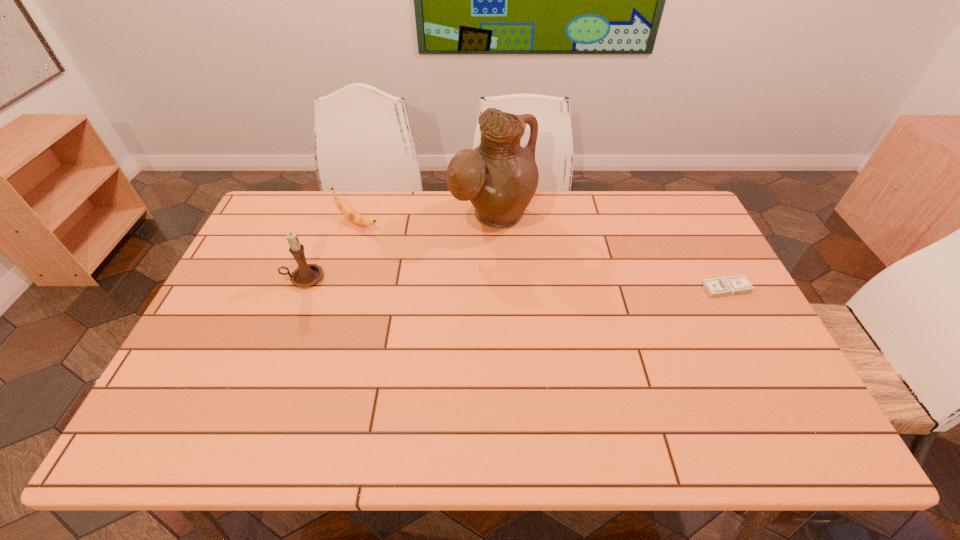
Locate an element on the screen. free spot on the desktop that is between the second tallest object and the rightmost object and is positioned at the spout of the second object from right to left is located at coordinates (550, 284).

You are a GUI agent. You are given a task and a screenshot of the screen. Output one action in this format:
    pyautogui.click(x=<x>, y=<y>)
    Task: Click on the vacant space on the desktop that is between the third shortest object and the shortest object and is positioned on the peel of the second shortest object from the top
    
    Given the screenshot: What is the action you would take?
    pyautogui.click(x=474, y=282)